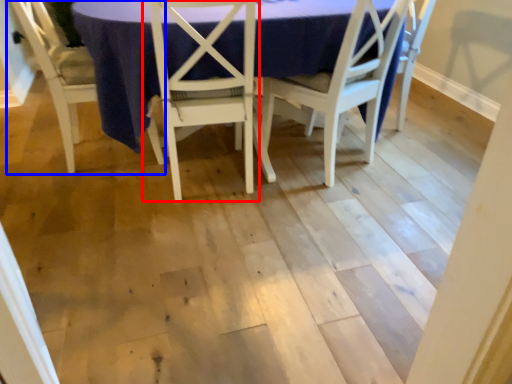
Question: Which point is closer to the camera, chair (highlighted by a red box) or chair (highlighted by a blue box)?

Choices:
 (A) chair
 (B) chair

Answer: (A)